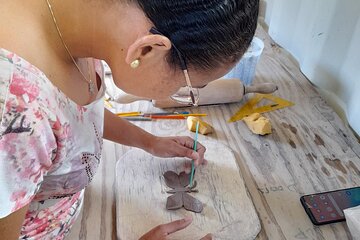
At what (x,y) coordinates should I click in order to perform the action: click on rolling pin. Please return your answer as a coordinate pair (x, y). Looking at the image, I should click on (236, 92).